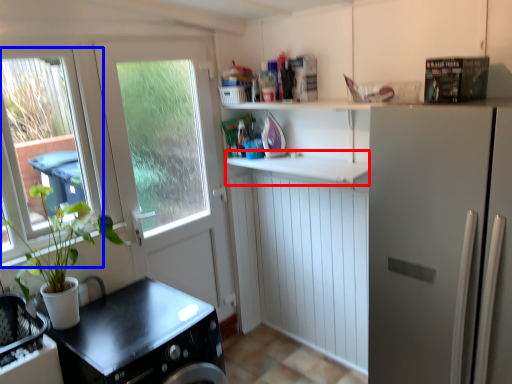
Question: Which of the following is the closest to the observer, counter top (highlighted by a red box) or window (highlighted by a blue box)?

Choices:
 (A) counter top
 (B) window

Answer: (B)